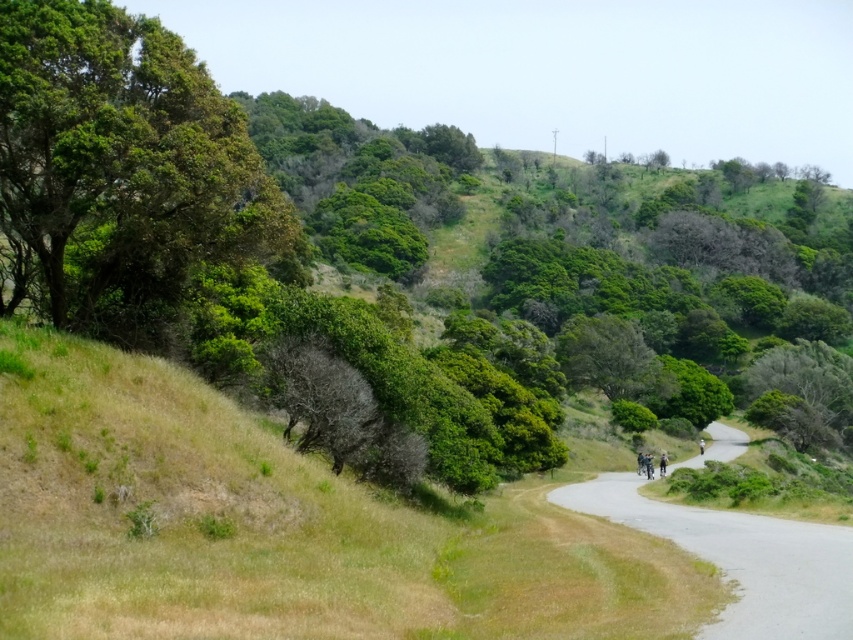
Can you confirm if green leafy tree at left is bigger than gray asphalt road at center?

No, green leafy tree at left is not bigger than gray asphalt road at center.

Is point (213, 240) farther from viewer compared to point (636, 497)?

No, (213, 240) is in front of (636, 497).

Image resolution: width=853 pixels, height=640 pixels. Find the location of `green leafy tree at left`. green leafy tree at left is located at coordinates (123, 163).